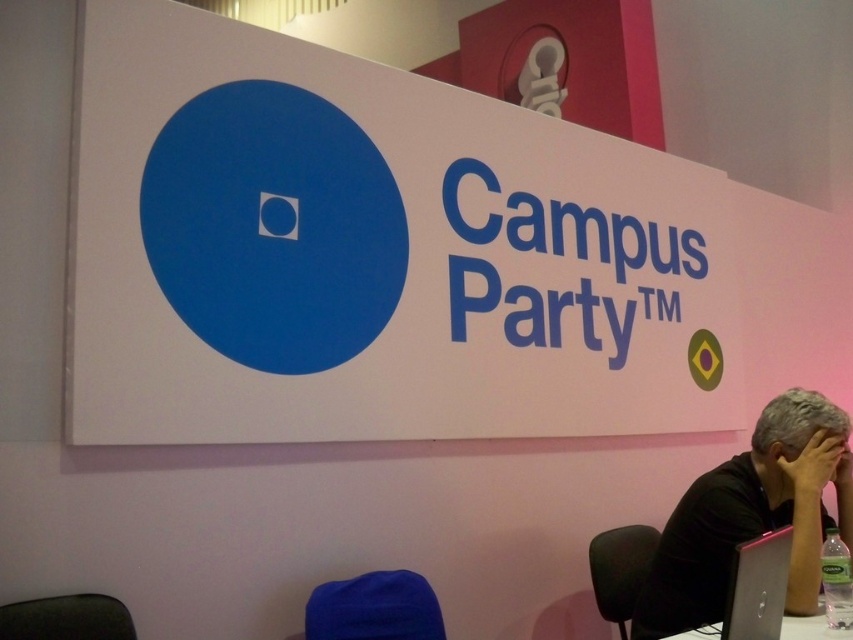
Consider the image. Can you confirm if matte black hand at lower right is bigger than white plastic table at lower right?

No, matte black hand at lower right is not bigger than white plastic table at lower right.

At what (x,y) coordinates should I click in order to perform the action: click on matte black hand at lower right. Please return your answer as a coordinate pair (x, y). Looking at the image, I should click on (817, 467).

Between white matte sign at upper center and black matte shirt at lower right, which one appears on the right side from the viewer's perspective?

From the viewer's perspective, black matte shirt at lower right appears more on the right side.

Can you confirm if white matte sign at upper center is positioned above black matte shirt at lower right?

Yes.

Is point (360, 241) in front of point (848, 432)?

No, (360, 241) is further to viewer.

Locate an element on the screen. white matte sign at upper center is located at coordinates (372, 253).

Consider the image. Can you confirm if black matte shirt at lower right is positioned to the right of silver metallic laptop at lower right?

Indeed, black matte shirt at lower right is positioned on the right side of silver metallic laptop at lower right.

Locate an element on the screen. This screenshot has height=640, width=853. black matte shirt at lower right is located at coordinates (752, 515).